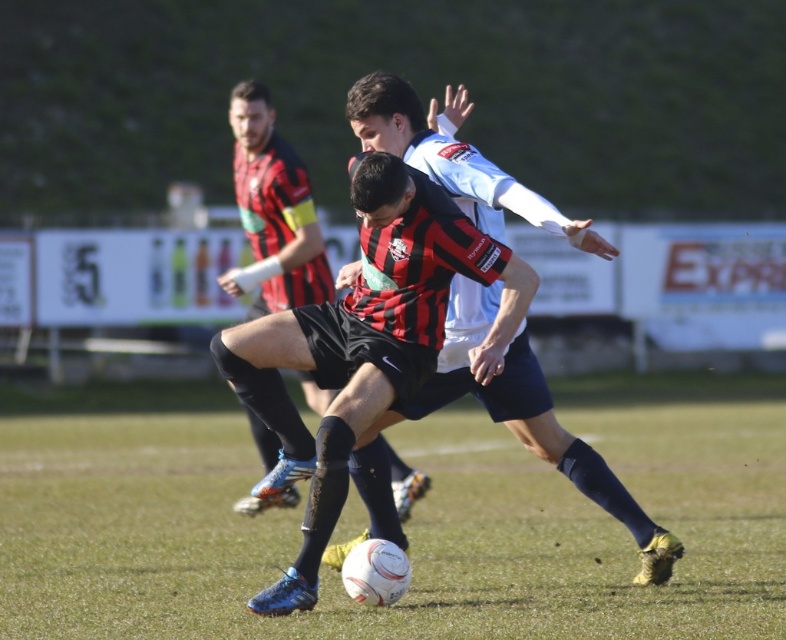
Is green grass at center below black and red striped jersey at center?

Yes.

Is green grass at center shorter than black and red striped jersey at center?

Yes.

Is point (4, 497) behind point (575, 241)?

Yes, it is behind point (575, 241).

At what (x,y) coordinates should I click in order to perform the action: click on green grass at center. Please return your answer as a coordinate pair (x, y). Looking at the image, I should click on 403,525.

Does green grass at center appear over matte black shorts at center?

No.

Can you confirm if green grass at center is positioned to the left of matte black shorts at center?

In fact, green grass at center is to the right of matte black shorts at center.

I want to click on green grass at center, so click(x=403, y=525).

Can you confirm if black and red striped jersey at center is positioned to the left of matte black shorts at center?

Incorrect, black and red striped jersey at center is not on the left side of matte black shorts at center.

Does point (476, 388) come closer to viewer compared to point (305, 294)?

Yes, point (476, 388) is closer to viewer.

Locate an element on the screen. Image resolution: width=786 pixels, height=640 pixels. black and red striped jersey at center is located at coordinates (531, 419).